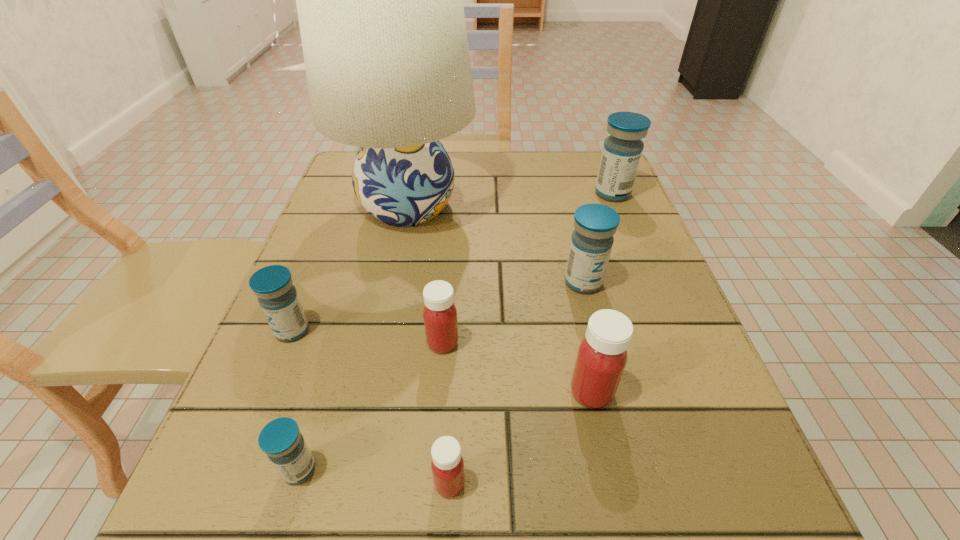
The image size is (960, 540). In order to click on free space that satisfies the following two spatial constraints: 1. on the front side of the second biggest red medicine; 2. on the left side of the second farthest red medicine in this screenshot , I will do `click(439, 392)`.

Find the location of a particular element. Image resolution: width=960 pixels, height=540 pixels. free spot that satisfies the following two spatial constraints: 1. on the front-facing side of the farthest red medicine; 2. on the left side of the tallest object is located at coordinates point(379,343).

You are a GUI agent. You are given a task and a screenshot of the screen. Output one action in this format:
    pyautogui.click(x=<x>, y=<y>)
    Task: Click on the free space in the image that satisfies the following two spatial constraints: 1. on the front-facing side of the lampshade; 2. on the left side of the biggest red medicine
    
    Given the screenshot: What is the action you would take?
    pyautogui.click(x=369, y=392)

This screenshot has width=960, height=540. In order to click on vacant space that satisfies the following two spatial constraints: 1. on the back side of the nearest red medicine; 2. on the left side of the third nearest medicine in this screenshot , I will do `click(454, 392)`.

Where is `vacant position in the image that satisfies the following two spatial constraints: 1. on the front-facing side of the blue lampshade; 2. on the back side of the biggest red medicine`? This screenshot has height=540, width=960. vacant position in the image that satisfies the following two spatial constraints: 1. on the front-facing side of the blue lampshade; 2. on the back side of the biggest red medicine is located at coordinates (369, 392).